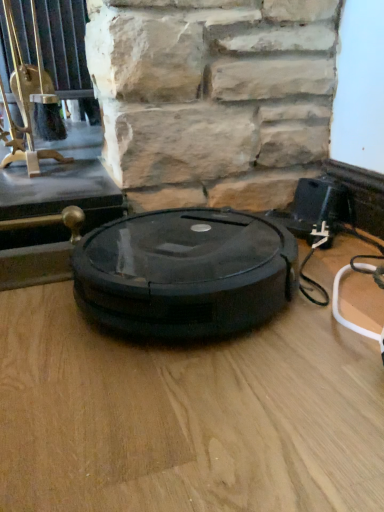
Question: Is black plastic robot vacuum cleaner at center completely or partially outside of brushed metal fireplace tool at upper left?

Choices:
 (A) no
 (B) yes

Answer: (B)

Question: Is black plastic robot vacuum cleaner at center in contact with brushed metal fireplace tool at upper left?

Choices:
 (A) yes
 (B) no

Answer: (B)

Question: From a real-world perspective, does black plastic robot vacuum cleaner at center stand above brushed metal fireplace tool at upper left?

Choices:
 (A) no
 (B) yes

Answer: (A)

Question: Considering the relative sizes of black plastic robot vacuum cleaner at center and brushed metal fireplace tool at upper left in the image provided, is black plastic robot vacuum cleaner at center shorter than brushed metal fireplace tool at upper left?

Choices:
 (A) yes
 (B) no

Answer: (A)

Question: From a real-world perspective, is black plastic robot vacuum cleaner at center located beneath brushed metal fireplace tool at upper left?

Choices:
 (A) yes
 (B) no

Answer: (A)

Question: Considering the relative sizes of black plastic robot vacuum cleaner at center and brushed metal fireplace tool at upper left in the image provided, is black plastic robot vacuum cleaner at center smaller than brushed metal fireplace tool at upper left?

Choices:
 (A) yes
 (B) no

Answer: (A)

Question: Can you confirm if brushed metal fireplace tool at upper left is taller than black plastic robot vacuum cleaner at center?

Choices:
 (A) yes
 (B) no

Answer: (A)

Question: Considering the relative sizes of brushed metal fireplace tool at upper left and black plastic robot vacuum cleaner at center in the image provided, is brushed metal fireplace tool at upper left shorter than black plastic robot vacuum cleaner at center?

Choices:
 (A) yes
 (B) no

Answer: (B)

Question: Would you say brushed metal fireplace tool at upper left is outside black plastic robot vacuum cleaner at center?

Choices:
 (A) no
 (B) yes

Answer: (B)

Question: Is brushed metal fireplace tool at upper left smaller than black plastic robot vacuum cleaner at center?

Choices:
 (A) yes
 (B) no

Answer: (B)

Question: Does brushed metal fireplace tool at upper left have a lesser width compared to black plastic robot vacuum cleaner at center?

Choices:
 (A) yes
 (B) no

Answer: (A)

Question: Can you confirm if brushed metal fireplace tool at upper left is wider than black plastic robot vacuum cleaner at center?

Choices:
 (A) no
 (B) yes

Answer: (A)

Question: In the image, is black plastic robot vacuum cleaner at center positioned in front of or behind brushed metal fireplace tool at upper left?

Choices:
 (A) behind
 (B) front

Answer: (B)